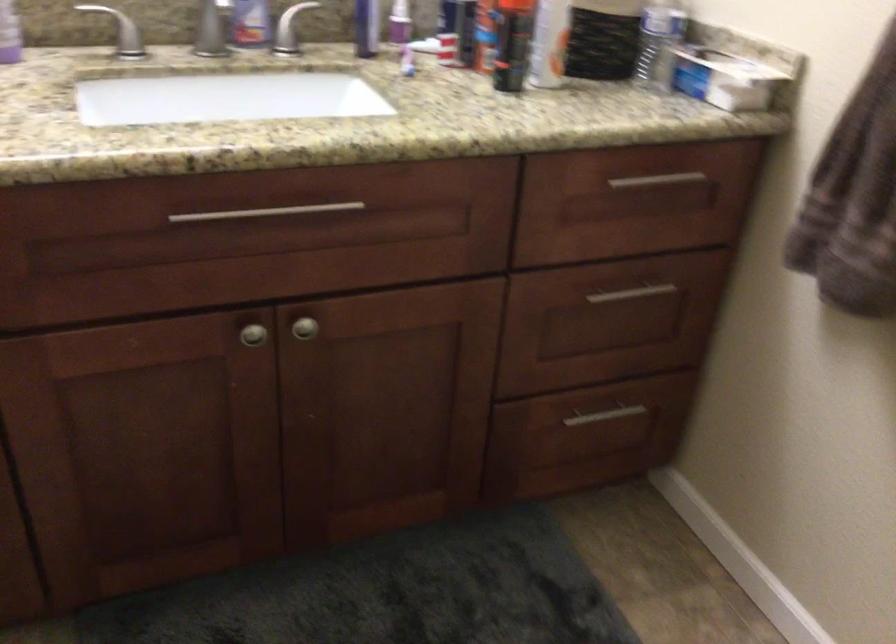
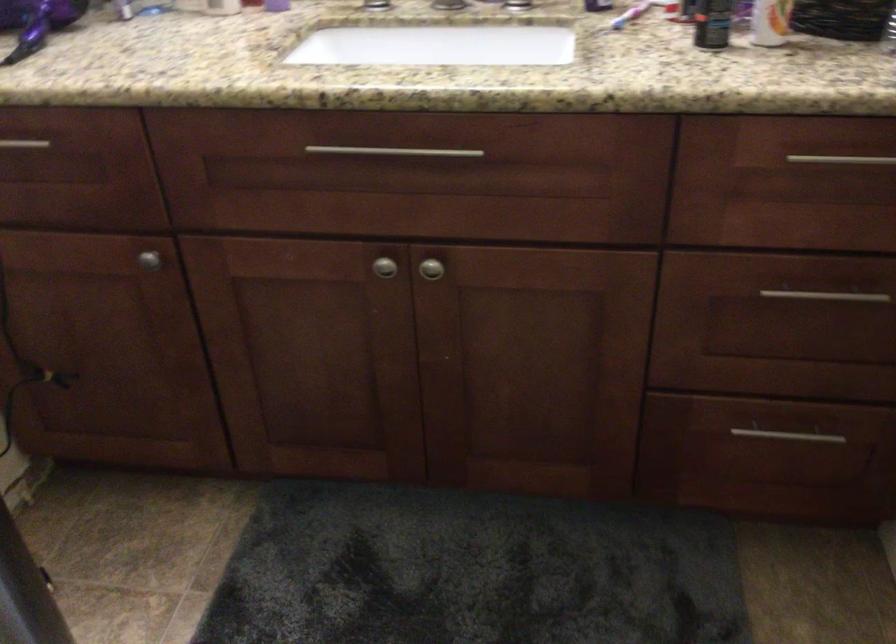
Locate, in the second image, the point that corresponds to point (268, 211) in the first image.

(394, 152)